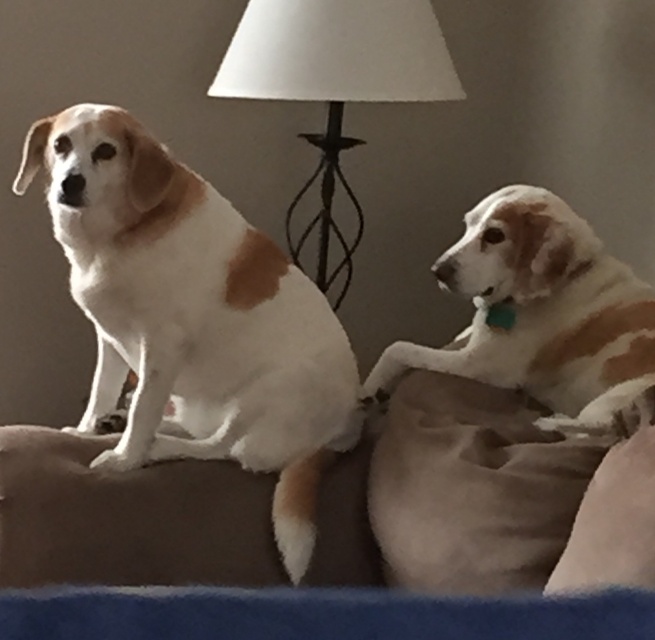
You are a dog owner trying to place a new toy between the soft suede pillow at lower right and the blue fabric dog bed at lower center. Based on their positions, where should you place the toy so it is between both objects?

The soft suede pillow at lower right is below the blue fabric dog bed at lower center, so placing the toy between them would require positioning it above the soft suede pillow at lower right and below the blue fabric dog bed at lower center.

You are a dog owner trying to decide if your new dog bed will fit comfortably between the white fur dog at left and the soft suede pillow at lower right. The bed is 12 inches tall. Can you determine if there is enough vertical space?

The white fur dog at left is taller than the soft suede pillow at lower right. Since the dog is taller than the pillow, the vertical space between them may vary depending on their positions. However, the bed is 12 inches tall, but without knowing the exact height difference between the dog and the pillow, it is uncertain if the bed will fit vertically. Consider measuring the space between them first.